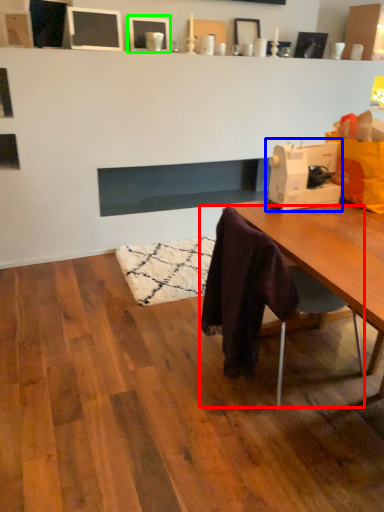
Question: Which object is positioned farthest from chair (highlighted by a red box)? Select from sewing machine (highlighted by a blue box) and picture frame (highlighted by a green box).

Choices:
 (A) sewing machine
 (B) picture frame

Answer: (B)